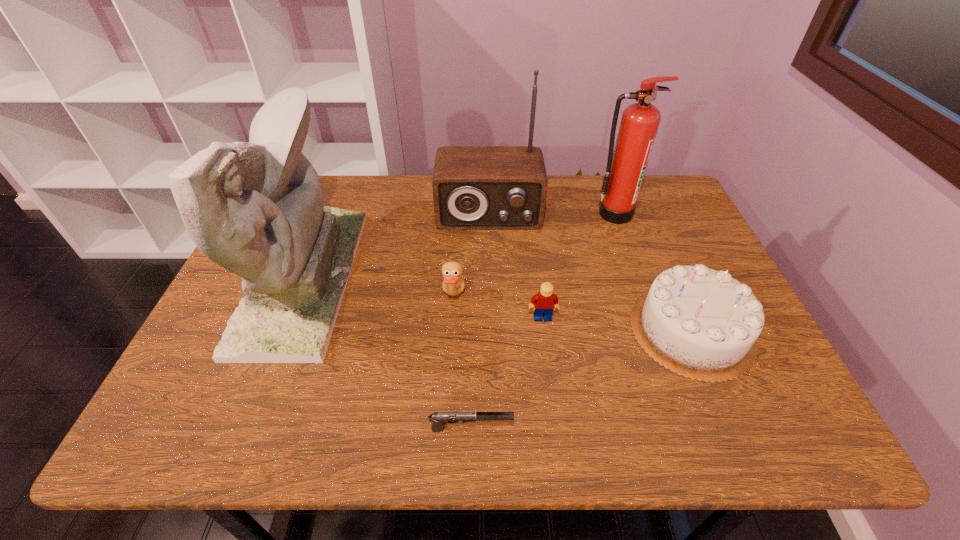
Locate an element on the screen. This screenshot has height=540, width=960. fire extinguisher that is at the right edge is located at coordinates (626, 166).

Image resolution: width=960 pixels, height=540 pixels. Find the location of `birthday cake that is at the right edge`. birthday cake that is at the right edge is located at coordinates (700, 323).

Identify the location of object that is at the far left corner. This screenshot has width=960, height=540. (257, 209).

This screenshot has width=960, height=540. In order to click on object that is at the far right corner in this screenshot , I will do `click(626, 166)`.

At what (x,y) coordinates should I click in order to perform the action: click on free space at the far edge. Please return your answer as a coordinate pair (x, y). This screenshot has width=960, height=540. Looking at the image, I should click on (372, 214).

You are a GUI agent. You are given a task and a screenshot of the screen. Output one action in this format:
    pyautogui.click(x=<x>, y=<y>)
    Task: Click on the vacant area at the near edge
    This screenshot has width=960, height=540.
    Given the screenshot: What is the action you would take?
    pyautogui.click(x=528, y=433)

Locate an element on the screen. vacant space at the left edge of the desktop is located at coordinates pyautogui.click(x=216, y=321).

In the image, there is a desktop. Identify the location of vacant area at the right edge. (689, 238).

Locate an element on the screen. free spot at the far right corner of the desktop is located at coordinates (660, 207).

This screenshot has width=960, height=540. I want to click on free space that is in between the duck and the sculpture, so click(x=378, y=287).